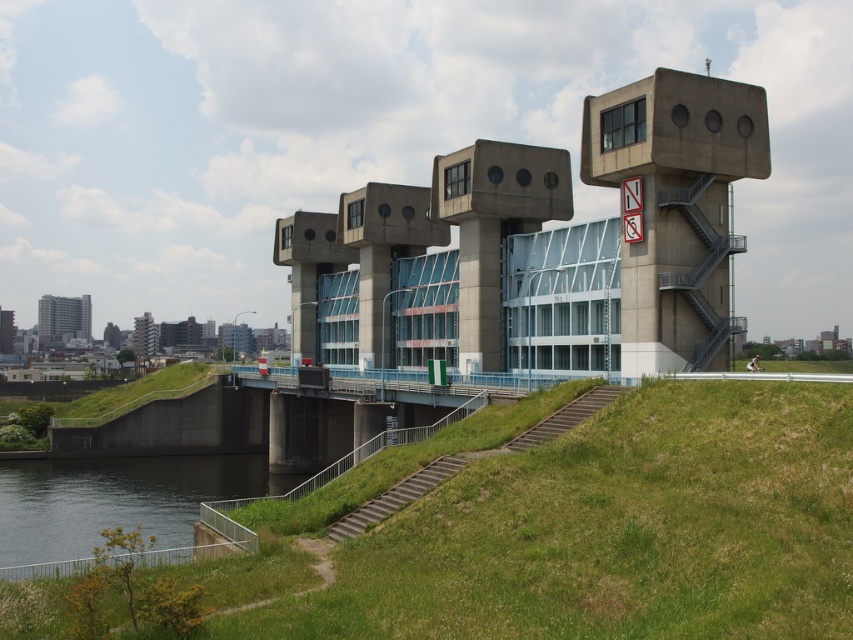
Question: Which of the following is the closest to the observer?

Choices:
 (A) dark gray concrete river at lower left
 (B) green grassy at lower center

Answer: (B)

Question: Does concrete building at center have a smaller size compared to dark gray concrete river at lower left?

Choices:
 (A) yes
 (B) no

Answer: (B)

Question: Which point appears farthest from the camera in this image?

Choices:
 (A) (199, 468)
 (B) (485, 182)
 (C) (540, 596)

Answer: (A)

Question: Which point appears farthest from the camera in this image?

Choices:
 (A) (614, 120)
 (B) (149, 467)

Answer: (B)

Question: Is green grassy at lower center wider than dark gray concrete river at lower left?

Choices:
 (A) no
 (B) yes

Answer: (A)

Question: Is concrete building at center positioned in front of dark gray concrete river at lower left?

Choices:
 (A) no
 (B) yes

Answer: (A)